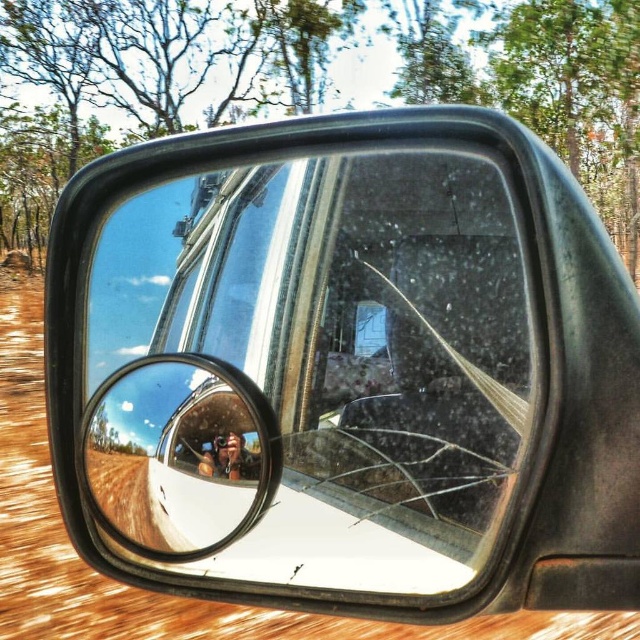
Consider the image. You are a photographer trying to capture the reflection in the clear glass convex mirror at center. To ensure the reflection of the rearview mirror is visible, where should you position yourself relative to the point at coordinates point (179, 454)?

The clear glass convex mirror at center is located at point (179, 454), so you should position yourself directly in front of this point to ensure the reflection of the rearview mirror is visible.

You are a photographer trying to capture the reflection in the clear glass convex mirror at center. You have a metallic silver camera at center. Since the mirror is taller than the camera, will the reflection of the camera be smaller or larger than the actual camera?

The clear glass convex mirror at center is much taller than the metallic silver camera at center, so the reflection of the metallic silver camera at center will appear smaller than the actual camera because convex mirrors distort reflections, making objects appear smaller than their actual size.